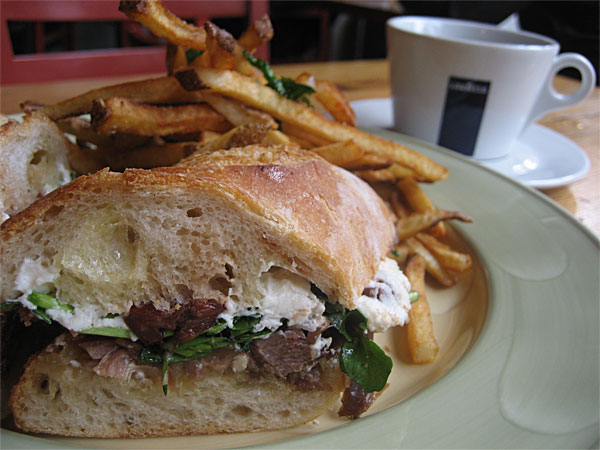
At what (x,y) coordinates should I click in order to perform the action: click on white cup. Please return your answer as a coordinate pair (x, y). Looking at the image, I should click on (488, 55).